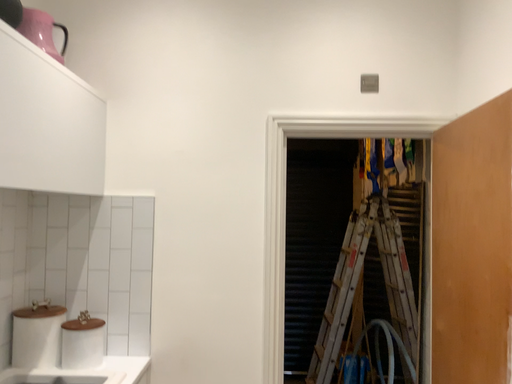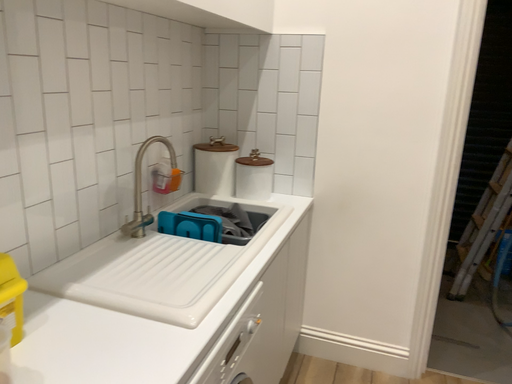
Question: Which way did the camera rotate in the video?

Choices:
 (A) rotated upward
 (B) rotated downward

Answer: (B)